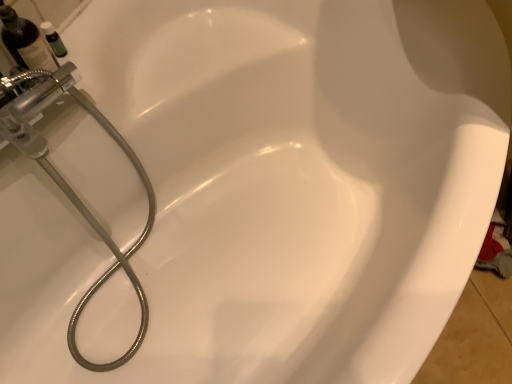
Question: Would you say green glass bottle at upper left is outside matte black bottle at upper left?

Choices:
 (A) no
 (B) yes

Answer: (B)

Question: From the image's perspective, is green glass bottle at upper left over matte black bottle at upper left?

Choices:
 (A) yes
 (B) no

Answer: (A)

Question: Could you tell me if green glass bottle at upper left is turned towards matte black bottle at upper left?

Choices:
 (A) yes
 (B) no

Answer: (B)

Question: From a real-world perspective, is green glass bottle at upper left below matte black bottle at upper left?

Choices:
 (A) yes
 (B) no

Answer: (A)

Question: Can you confirm if green glass bottle at upper left is thinner than matte black bottle at upper left?

Choices:
 (A) yes
 (B) no

Answer: (A)

Question: Is there a large distance between green glass bottle at upper left and matte black bottle at upper left?

Choices:
 (A) no
 (B) yes

Answer: (A)

Question: Is matte black bottle at upper left not inside green glass bottle at upper left?

Choices:
 (A) no
 (B) yes

Answer: (B)

Question: Can you confirm if matte black bottle at upper left is wider than green glass bottle at upper left?

Choices:
 (A) no
 (B) yes

Answer: (B)

Question: Is matte black bottle at upper left next to green glass bottle at upper left?

Choices:
 (A) no
 (B) yes

Answer: (B)

Question: From the image's perspective, is matte black bottle at upper left under green glass bottle at upper left?

Choices:
 (A) yes
 (B) no

Answer: (A)

Question: Does matte black bottle at upper left have a larger size compared to green glass bottle at upper left?

Choices:
 (A) no
 (B) yes

Answer: (B)

Question: Considering the relative sizes of matte black bottle at upper left and green glass bottle at upper left in the image provided, is matte black bottle at upper left taller than green glass bottle at upper left?

Choices:
 (A) no
 (B) yes

Answer: (B)

Question: Considering the relative sizes of brushed metal showerhead at left and matte black bottle at upper left in the image provided, is brushed metal showerhead at left taller than matte black bottle at upper left?

Choices:
 (A) no
 (B) yes

Answer: (B)